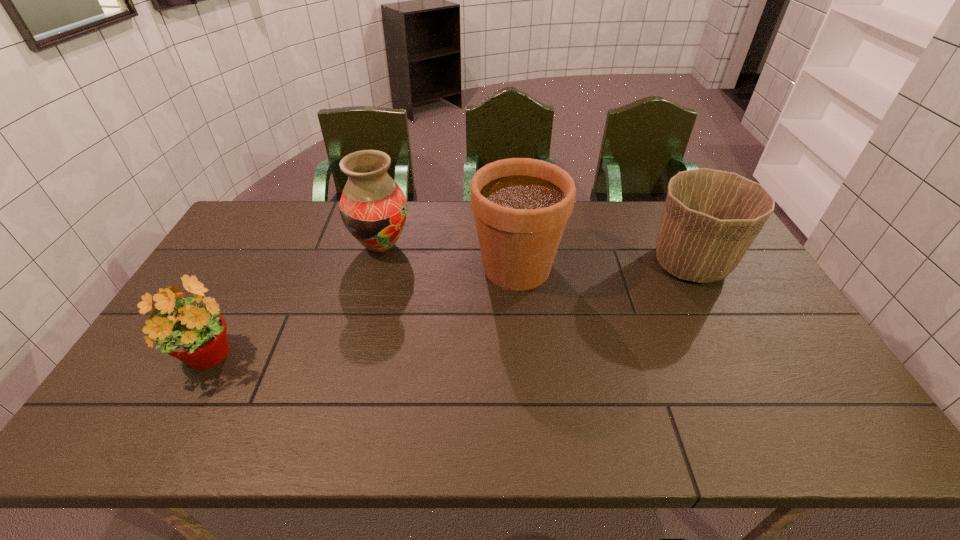
What are the coordinates of `object that is at the left edge` in the screenshot? It's located at (195, 334).

The width and height of the screenshot is (960, 540). I want to click on object located at the right edge, so click(710, 218).

This screenshot has height=540, width=960. I want to click on object that is at the far right corner, so click(710, 218).

The image size is (960, 540). In the image, there is a desktop. Find the location of `free space at the far edge`. free space at the far edge is located at coordinates (574, 230).

Locate an element on the screen. The image size is (960, 540). vacant space at the near edge of the desktop is located at coordinates (617, 428).

Find the location of `free region at the left edge`. free region at the left edge is located at coordinates click(210, 280).

Identify the location of vacant space at the right edge. Image resolution: width=960 pixels, height=540 pixels. (758, 290).

You are a GUI agent. You are given a task and a screenshot of the screen. Output one action in this format:
    pyautogui.click(x=<x>, y=<y>)
    Task: Click on the vacant point located between the nearest flowerpot and the third object from right to left
    The width and height of the screenshot is (960, 540).
    Given the screenshot: What is the action you would take?
    pyautogui.click(x=295, y=303)

The width and height of the screenshot is (960, 540). In order to click on vacant space that is in between the rightmost flowerpot and the leftmost flowerpot in this screenshot , I will do `click(450, 312)`.

Locate an element on the screen. This screenshot has width=960, height=540. vacant area that lies between the leftmost flowerpot and the third object from left to right is located at coordinates (363, 313).